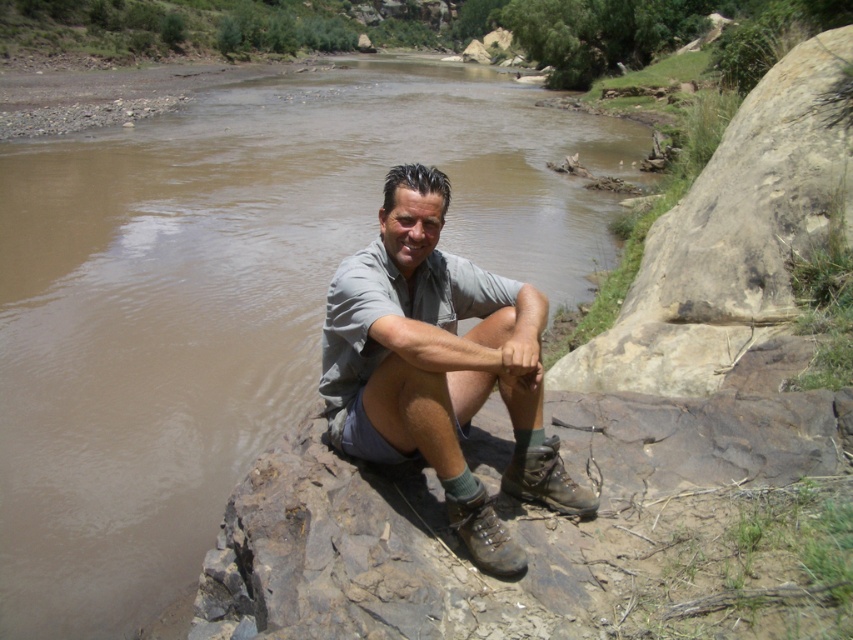
Question: Estimate the real-world distances between objects in this image. Which object is farther from the muddy leather hiking boot at lower center?

Choices:
 (A) brown muddy water at center
 (B) brown leather boot at lower center
 (C) gray fabric shirt at center

Answer: (A)

Question: Is brown leather boot at lower center to the right of muddy leather hiking boot at lower center from the viewer's perspective?

Choices:
 (A) yes
 (B) no

Answer: (A)

Question: Is gray fabric shirt at center smaller than muddy leather hiking boot at lower center?

Choices:
 (A) yes
 (B) no

Answer: (B)

Question: Which point is farther to the camera?

Choices:
 (A) (492, 541)
 (B) (573, 490)

Answer: (B)

Question: Is gray fabric shirt at center further to camera compared to brown leather boot at lower center?

Choices:
 (A) yes
 (B) no

Answer: (B)

Question: Which of the following is the closest to the observer?

Choices:
 (A) click(x=460, y=532)
 (B) click(x=525, y=465)
 (C) click(x=451, y=292)

Answer: (A)